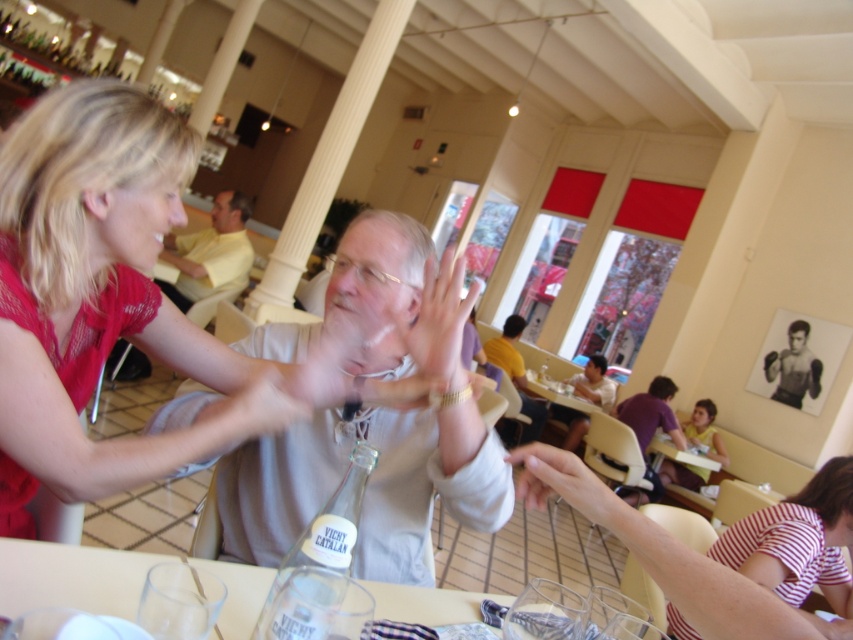
Does point (759, 532) come behind point (457, 301)?

Yes, point (759, 532) is behind point (457, 301).

Which of these two, striped cotton shirt at lower right or smooth skin hand at center, stands shorter?

Standing shorter between the two is smooth skin hand at center.

The width and height of the screenshot is (853, 640). What are the coordinates of `striped cotton shirt at lower right` in the screenshot? It's located at coord(799,545).

Is purple cotton shirt at lower right positioned in front of light brown leather jacket at center?

Yes, it is.

Between point (643, 458) and point (511, 362), which one is positioned behind?

Point (511, 362)

Is point (643, 432) positioned after point (535, 412)?

That is False.

Where is `purple cotton shirt at lower right`? purple cotton shirt at lower right is located at coordinates (651, 413).

Does clear glass table at lower center have a lesser height compared to smooth white hand at center?

No, clear glass table at lower center is not shorter than smooth white hand at center.

Which is more to the right, clear glass table at lower center or smooth white hand at center?

From the viewer's perspective, smooth white hand at center appears more on the right side.

Does point (262, 572) come behind point (543, 486)?

Yes, it is behind point (543, 486).

Where is `clear glass table at lower center`? The height and width of the screenshot is (640, 853). clear glass table at lower center is located at coordinates (71, 577).